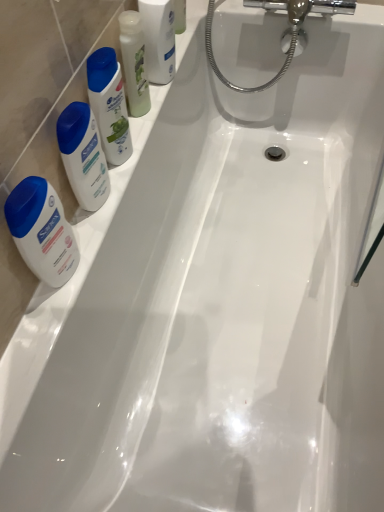
Question: Is translucent plastic mouthwash at upper left, which is the 1th mouthwash from left to right, not within clear plastic mouthwash at upper left, which ranks as the 2th mouthwash in left-to-right order?

Choices:
 (A) no
 (B) yes

Answer: (B)

Question: Does translucent plastic mouthwash at upper left, marked as the second mouthwash in a right-to-left arrangement, lie in front of clear plastic mouthwash at upper left, which ranks as the 2th mouthwash in left-to-right order?

Choices:
 (A) yes
 (B) no

Answer: (A)

Question: Considering the relative positions of translucent plastic mouthwash at upper left, marked as the second mouthwash in a right-to-left arrangement, and clear plastic mouthwash at upper left, which ranks as the 2th mouthwash in left-to-right order, in the image provided, is translucent plastic mouthwash at upper left, marked as the second mouthwash in a right-to-left arrangement, to the right of clear plastic mouthwash at upper left, which ranks as the 2th mouthwash in left-to-right order, from the viewer's perspective?

Choices:
 (A) no
 (B) yes

Answer: (A)

Question: Is translucent plastic mouthwash at upper left, which is the 1th mouthwash from left to right, thinner than clear plastic mouthwash at upper left, which is the 1th mouthwash from right to left?

Choices:
 (A) yes
 (B) no

Answer: (A)

Question: From a real-world perspective, is translucent plastic mouthwash at upper left, marked as the second mouthwash in a right-to-left arrangement, physically below clear plastic mouthwash at upper left, which ranks as the 2th mouthwash in left-to-right order?

Choices:
 (A) no
 (B) yes

Answer: (B)

Question: Is translucent plastic mouthwash at upper left, marked as the second mouthwash in a right-to-left arrangement, taller than clear plastic mouthwash at upper left, which ranks as the 2th mouthwash in left-to-right order?

Choices:
 (A) no
 (B) yes

Answer: (A)

Question: Considering the relative positions of translucent plastic mouthwash at upper left, which is the 1th mouthwash from left to right, and matte white lotion at left in the image provided, is translucent plastic mouthwash at upper left, which is the 1th mouthwash from left to right, to the right of matte white lotion at left from the viewer's perspective?

Choices:
 (A) no
 (B) yes

Answer: (B)

Question: Does translucent plastic mouthwash at upper left, which is the 1th mouthwash from left to right, have a greater width compared to matte white lotion at left?

Choices:
 (A) no
 (B) yes

Answer: (A)

Question: Does translucent plastic mouthwash at upper left, marked as the second mouthwash in a right-to-left arrangement, turn towards matte white lotion at left?

Choices:
 (A) no
 (B) yes

Answer: (A)

Question: Is translucent plastic mouthwash at upper left, which is the 1th mouthwash from left to right, looking in the opposite direction of matte white lotion at left?

Choices:
 (A) no
 (B) yes

Answer: (A)

Question: Is translucent plastic mouthwash at upper left, marked as the second mouthwash in a right-to-left arrangement, closer to the viewer compared to matte white lotion at left?

Choices:
 (A) no
 (B) yes

Answer: (A)

Question: Is translucent plastic mouthwash at upper left, which is the 1th mouthwash from left to right, bigger than matte white lotion at left?

Choices:
 (A) no
 (B) yes

Answer: (A)

Question: From a real-world perspective, is matte white shampoo at left, arranged as the 2th cleaning product when viewed from the top, located higher than translucent plastic mouthwash at upper left, marked as the second mouthwash in a right-to-left arrangement?

Choices:
 (A) no
 (B) yes

Answer: (A)